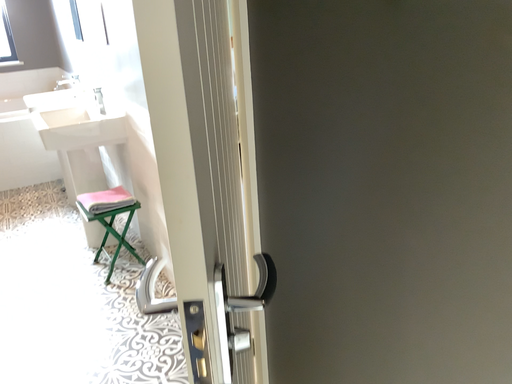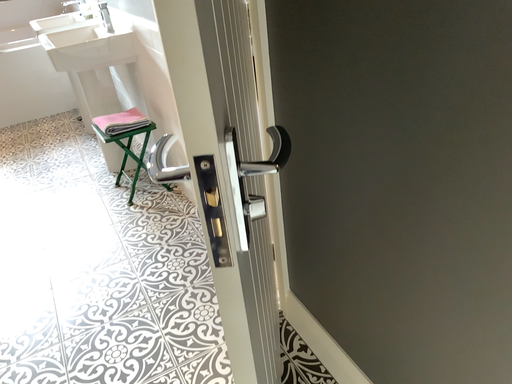
Question: Which way did the camera rotate in the video?

Choices:
 (A) rotated downward
 (B) rotated upward

Answer: (A)